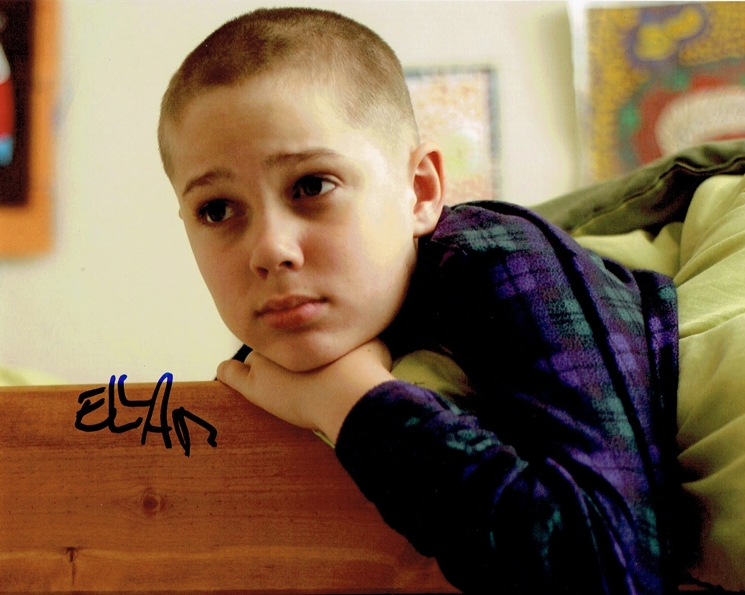
Identify the location of large picture. (626, 93).